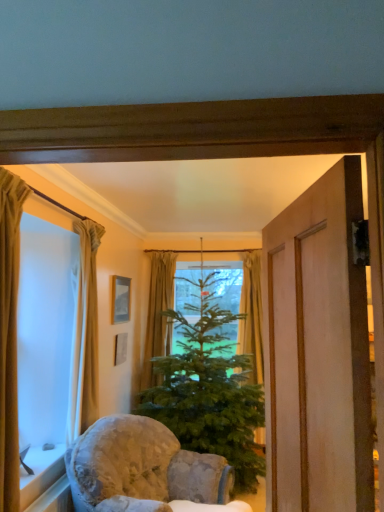
Question: Is beige fabric curtain at left, which ranks as the third curtain in back-to-front order, taller or shorter than green fabric curtain at center, which is the fourth curtain in front-to-back order?

Choices:
 (A) short
 (B) tall

Answer: (A)

Question: Considering the positions of point (87, 302) and point (158, 291), is point (87, 302) closer or farther from the camera than point (158, 291)?

Choices:
 (A) farther
 (B) closer

Answer: (B)

Question: Estimate the real-world distances between objects in this image. Which object is closer to the green matte christmas tree at center?

Choices:
 (A) white stone window sill at lower left
 (B) beige fabric curtain at left, placed as the fourth curtain when sorted from back to front
 (C) green fabric curtain at center, the 2th curtain when ordered from back to front
 (D) matte gray picture frame at center, the first picture frame when ordered from bottom to top
 (E) green fabric curtain at center, which is the fourth curtain in front-to-back order

Answer: (C)

Question: Which object is positioned closest to the green fabric curtain at center, which is the first curtain in right-to-left order?

Choices:
 (A) matte gray picture frame at center, the 2th picture frame when ordered from top to bottom
 (B) green fabric curtain at center, acting as the third curtain starting from the left
 (C) fluffy fabric chair at lower center
 (D) beige fabric curtain at left, the fourth curtain from the right
 (E) beige fabric curtain at left, placed as the third curtain when sorted from right to left

Answer: (B)